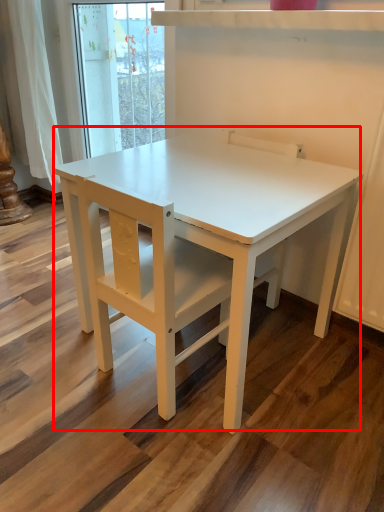
Question: From the image's perspective, where is table (annotated by the red box) located relative to chair?

Choices:
 (A) below
 (B) above

Answer: (A)